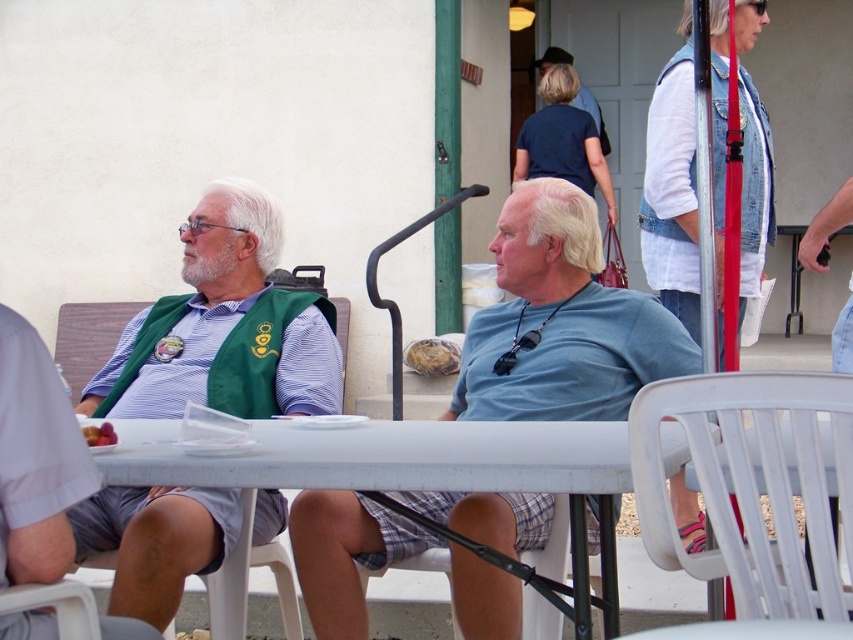
Question: Which of the following is the farthest from the observer?

Choices:
 (A) (535, 182)
 (B) (161, 422)
 (C) (305, 342)

Answer: (C)

Question: Can you confirm if blue cotton shirt at center is positioned to the left of green fabric vest at left?

Choices:
 (A) yes
 (B) no

Answer: (B)

Question: Does green fabric vest at left have a larger size compared to white plastic chair at lower right?

Choices:
 (A) no
 (B) yes

Answer: (A)

Question: Which object is farther from the camera taking this photo?

Choices:
 (A) green fabric vest at left
 (B) white plastic table at center
 (C) white plastic chair at lower right

Answer: (A)

Question: Among these objects, which one is farthest from the camera?

Choices:
 (A) white plastic chair at lower right
 (B) blue cotton shirt at center
 (C) white plastic table at center

Answer: (B)

Question: Is blue cotton shirt at center wider than green fabric vest at left?

Choices:
 (A) no
 (B) yes

Answer: (A)